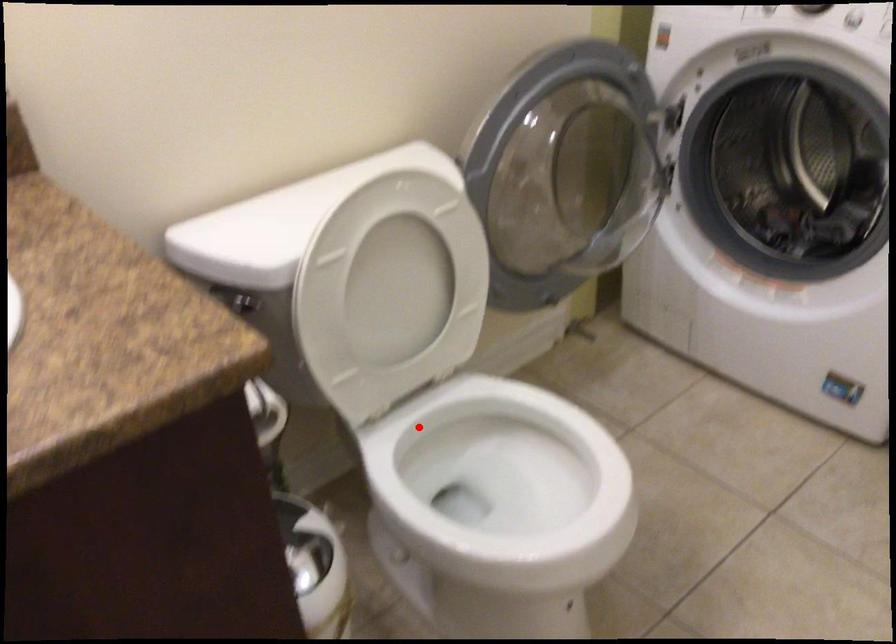
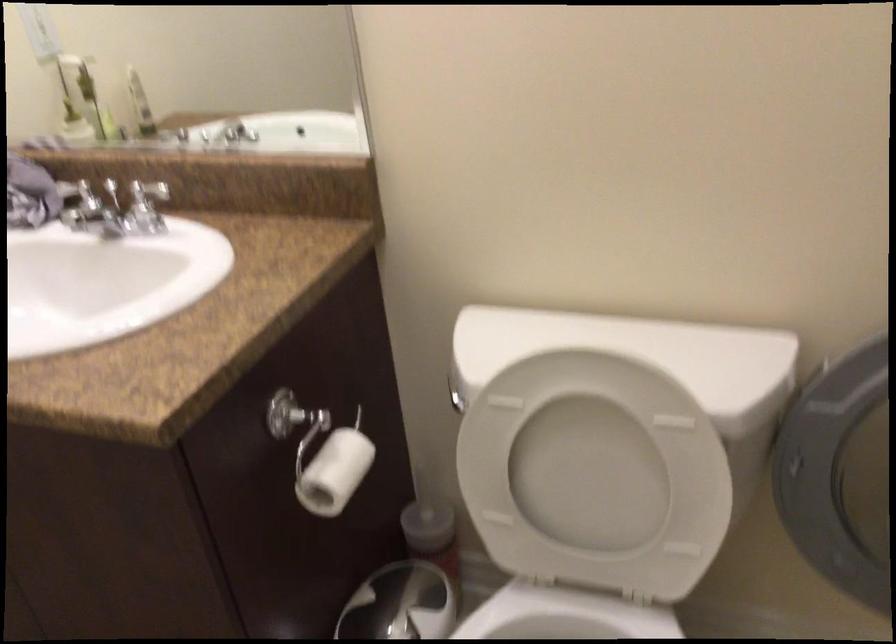
The point at the highlighted location is marked in the first image. Where is the corresponding point in the second image?

(564, 616)